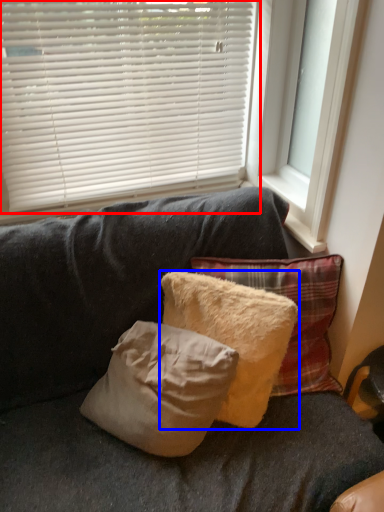
Question: Which point is further to the camera, window blind (highlighted by a red box) or pillow (highlighted by a blue box)?

Choices:
 (A) window blind
 (B) pillow

Answer: (A)